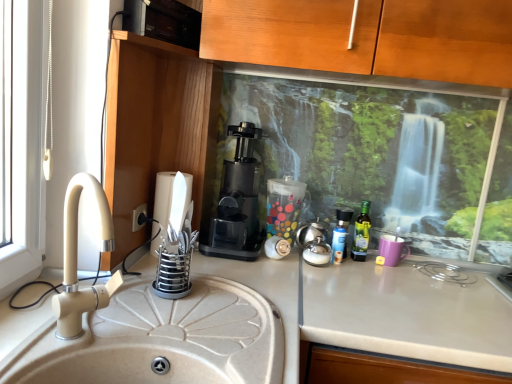
In order to click on vacant area in front of green glass bottle at right, which is counted as the second bottle, starting from the left in this screenshot , I will do `click(368, 277)`.